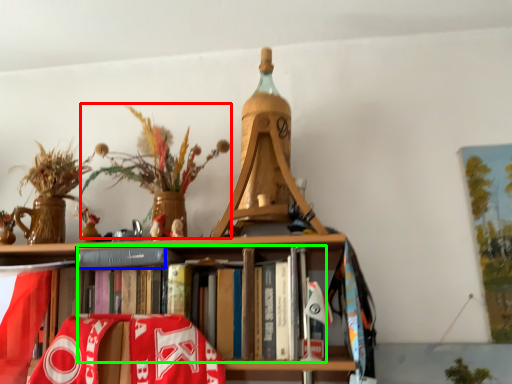
Question: Which object is the closest to the floral arrangement (highlighted by a red box)? Choose among these: paperback book (highlighted by a blue box) or book (highlighted by a green box).

Choices:
 (A) paperback book
 (B) book

Answer: (A)